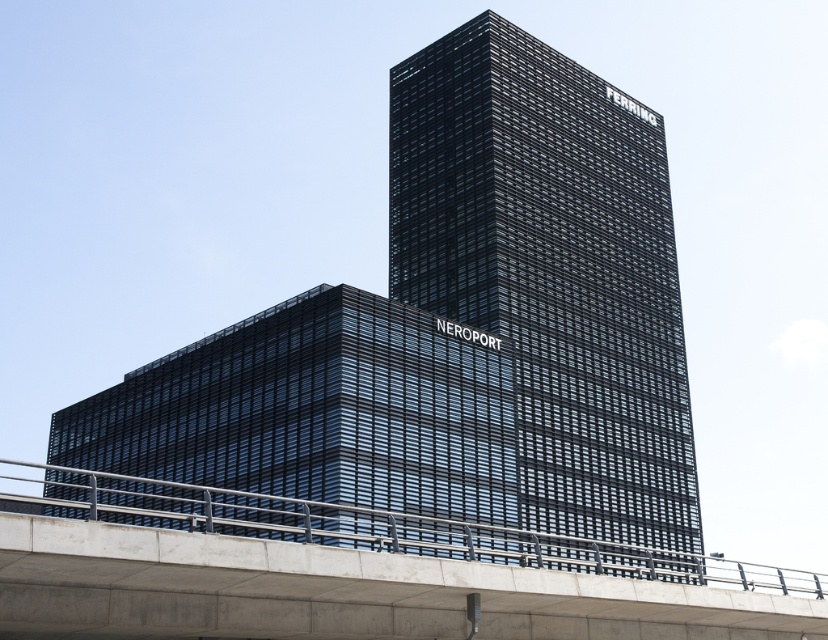
Who is positioned more to the left, black glass building at center or concrete bridge at lower center?

concrete bridge at lower center is more to the left.

Where is `black glass building at center`? The image size is (828, 640). black glass building at center is located at coordinates click(552, 269).